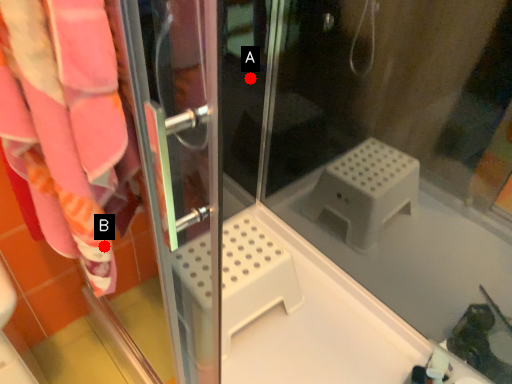
Question: Two points are circled on the image, labeled by A and B beside each circle. Which of the following is the closest to the observer?

Choices:
 (A) A is closer
 (B) B is closer

Answer: (B)